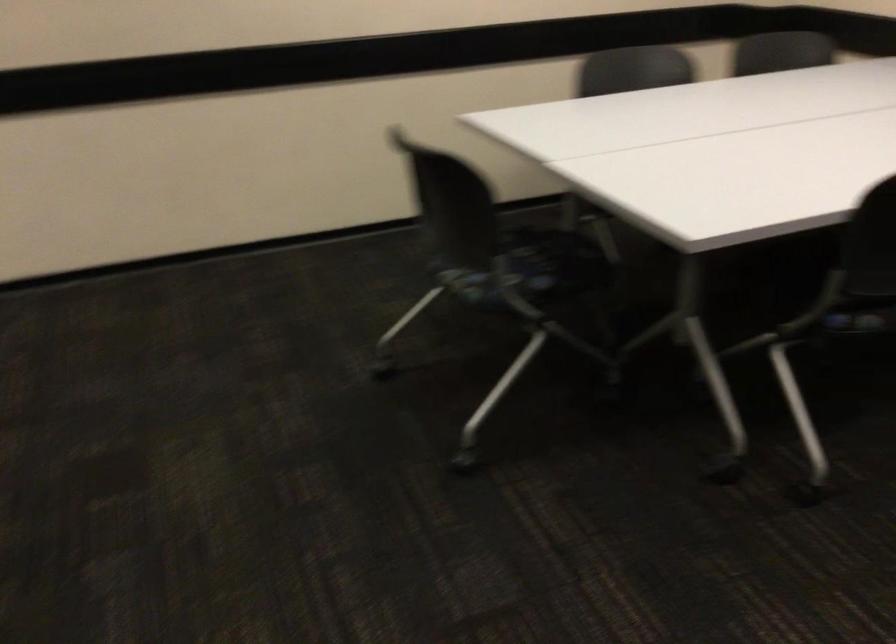
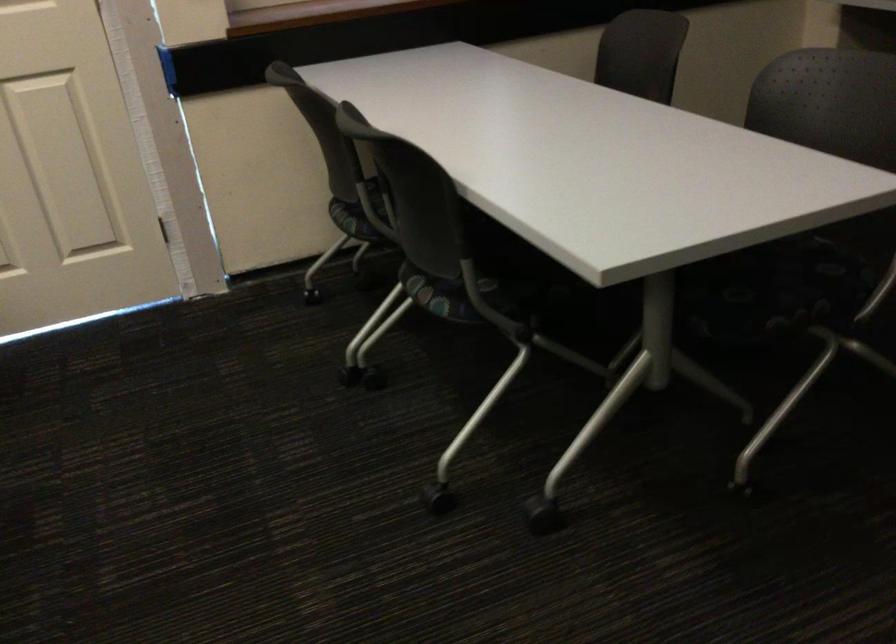
How did the camera likely rotate?

The camera's rotation is toward right-down.